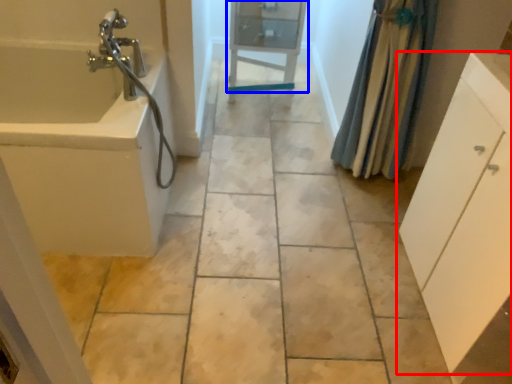
Question: Which of the following is the closest to the observer, bathroom cabinet (highlighted by a red box) or cabinetry (highlighted by a blue box)?

Choices:
 (A) bathroom cabinet
 (B) cabinetry

Answer: (A)